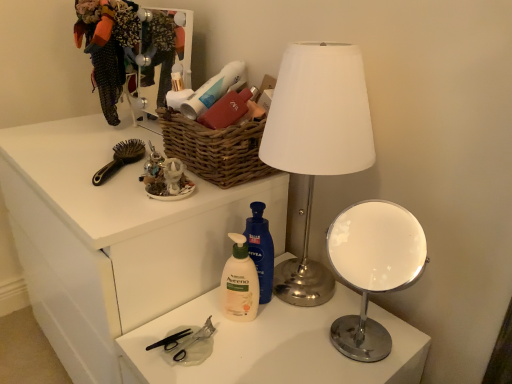
Image resolution: width=512 pixels, height=384 pixels. Find the location of `vacant space underneath metallic silver lamp at center (from a real-world perspective)`. vacant space underneath metallic silver lamp at center (from a real-world perspective) is located at coordinates (309, 302).